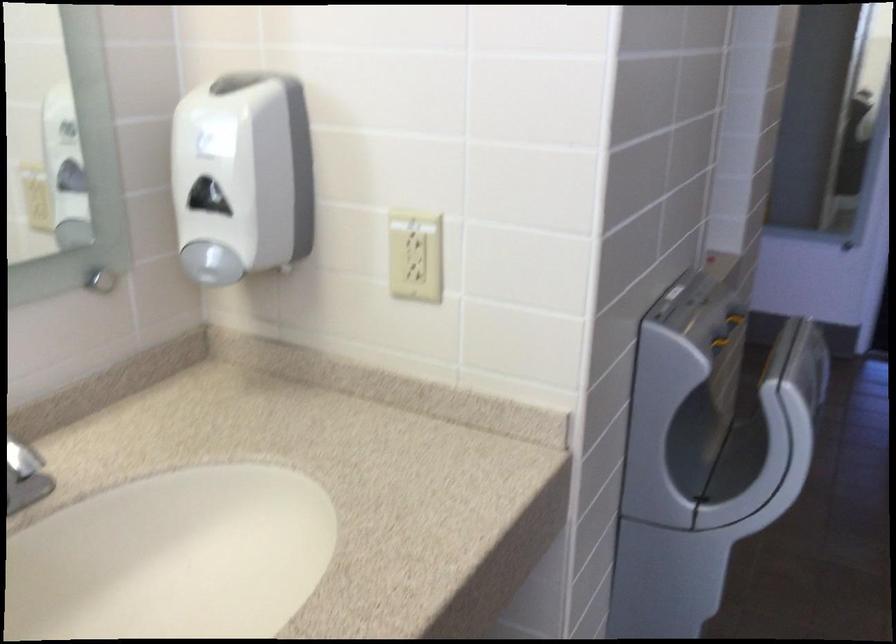
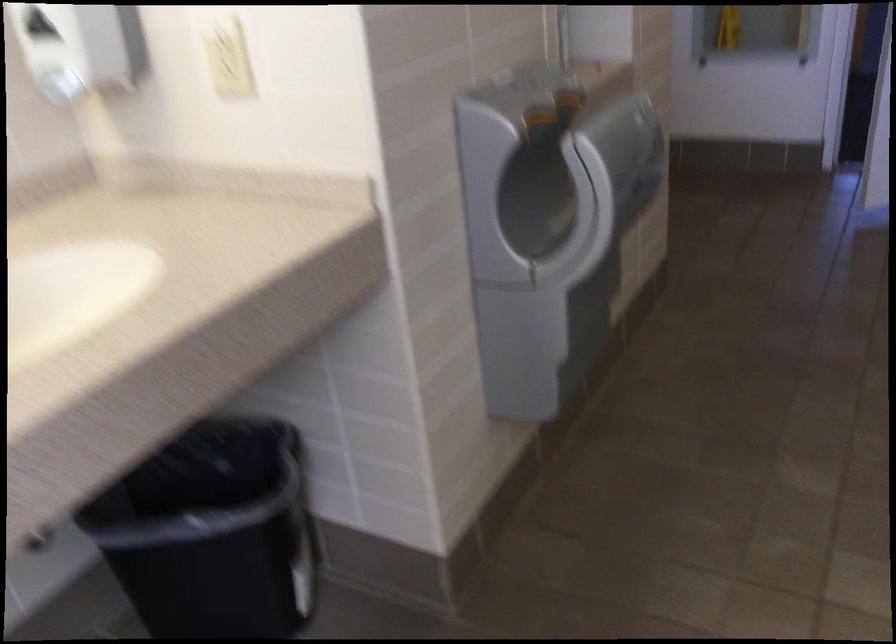
Which direction would the cameraman need to move to produce the second image?

The movement direction of the cameraman is right, backward.